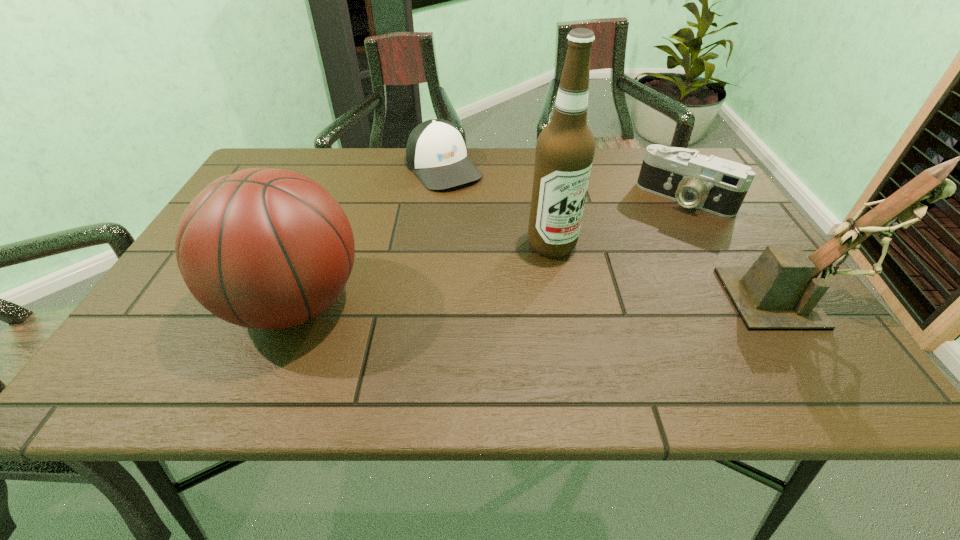
This screenshot has height=540, width=960. What are the coordinates of `vacant spot on the desktop that is between the basketball and the figurine and is positioned on the front panel of the cap` in the screenshot? It's located at (565, 300).

Identify the location of free space on the desktop that is between the basketball and the figurine and is positioned on the lens of the camera. (612, 300).

This screenshot has height=540, width=960. Find the location of `vacant space on the desktop that is between the leftmost object and the figurine and is positioned on the label of the third object from right to left`. vacant space on the desktop that is between the leftmost object and the figurine and is positioned on the label of the third object from right to left is located at coordinates (620, 300).